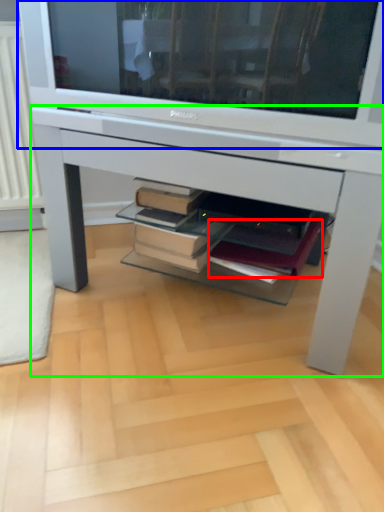
Question: Which is nearer to the paperback book (highlighted by a red box)? television (highlighted by a blue box) or desk (highlighted by a green box).

Choices:
 (A) television
 (B) desk

Answer: (B)